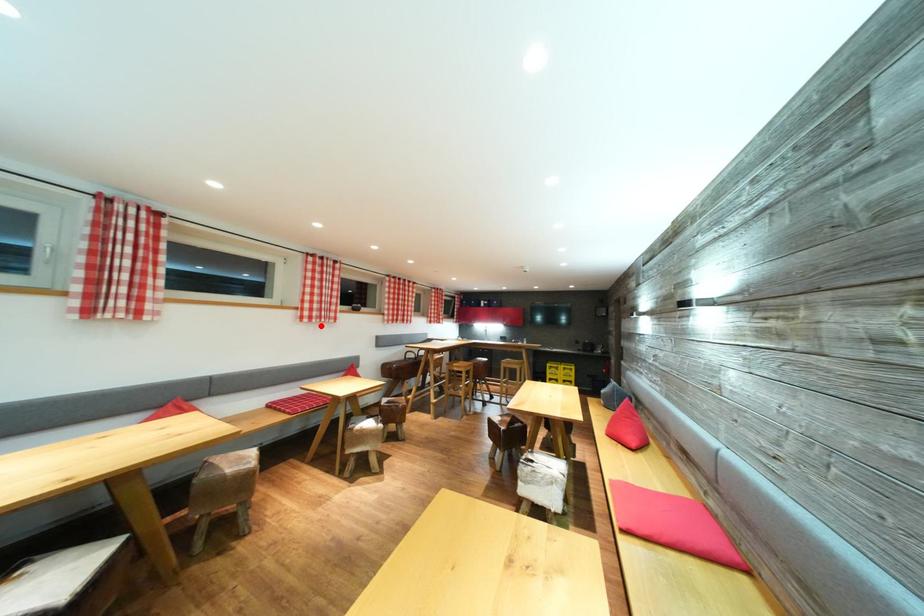
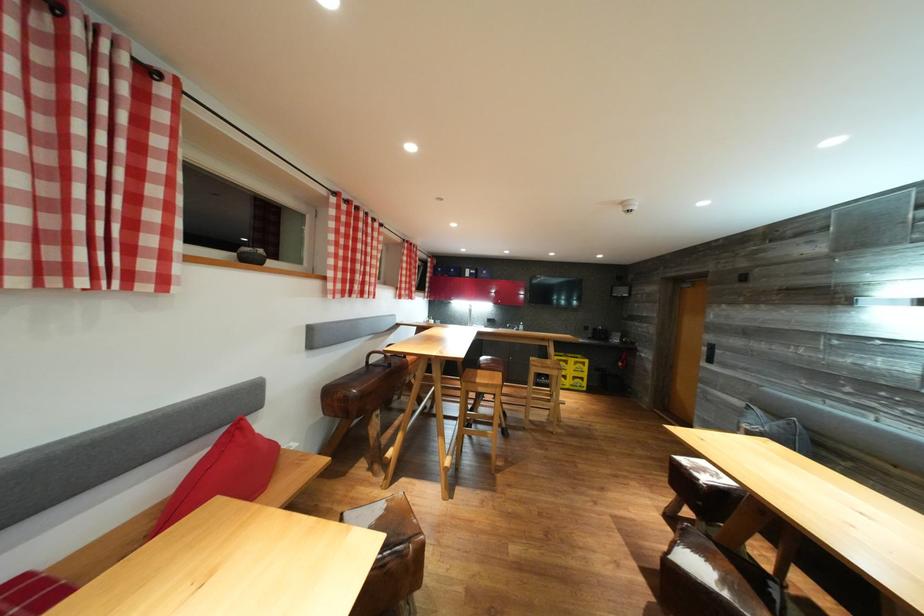
Locate, in the second image, the point that corresponds to the highlighted location in the first image.

(23, 286)